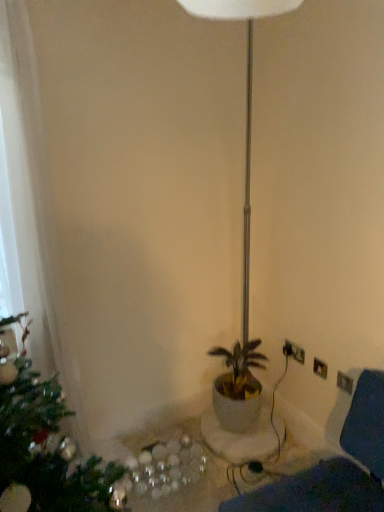
Question: Is white fabric swivel chair at lower right bigger or smaller than white plastic electric outlet at lower right?

Choices:
 (A) small
 (B) big

Answer: (B)

Question: Would you say white fabric swivel chair at lower right is to the left or to the right of white plastic electric outlet at lower right in the picture?

Choices:
 (A) left
 (B) right

Answer: (A)

Question: Estimate the real-world distances between objects in this image. Which object is farther from the white plastic electric outlet at lower right?

Choices:
 (A) white fabric swivel chair at lower right
 (B) white glossy table at lower center

Answer: (A)

Question: Estimate the real-world distances between objects in this image. Which object is closer to the white fabric swivel chair at lower right?

Choices:
 (A) white plastic electric outlet at lower right
 (B) white glossy table at lower center

Answer: (B)